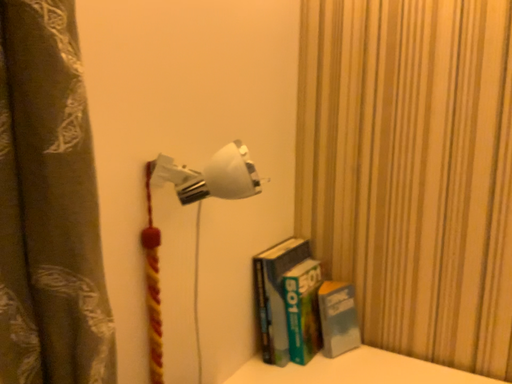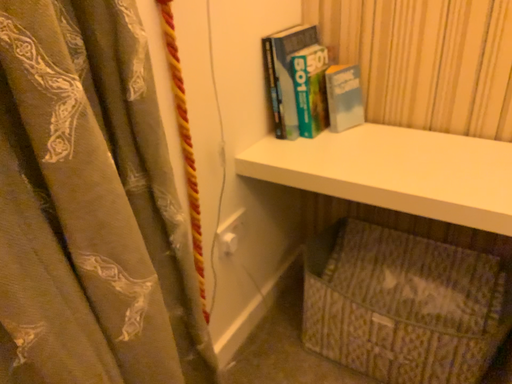
Question: Which way did the camera rotate in the video?

Choices:
 (A) rotated upward
 (B) rotated downward

Answer: (B)